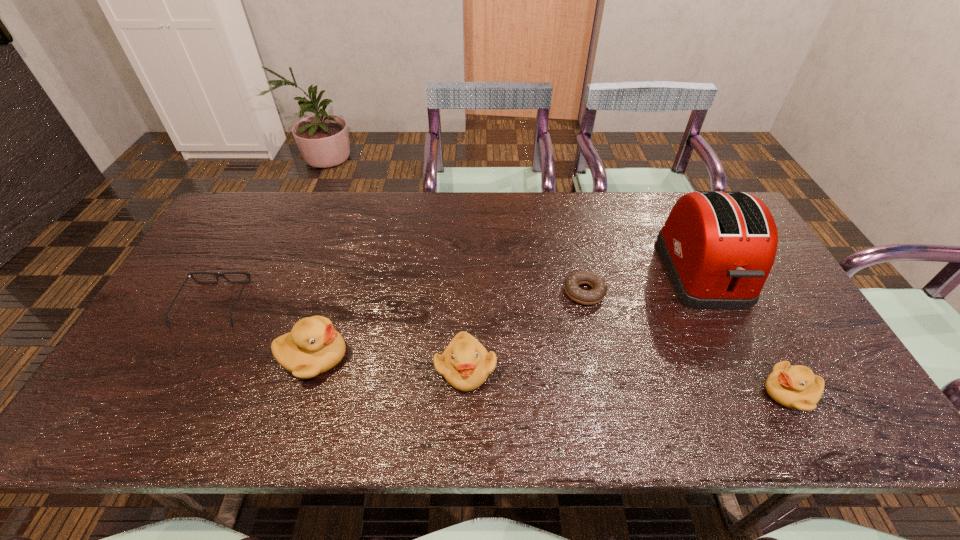
To ensure equal spacing by inserting another duckling among them, please point out a vacant spot for this new duckling. Please provide its 2D coordinates. Your answer should be formatted as a tuple, i.e. [(x, y)], where the tuple contains the x and y coordinates of a point satisfying the conditions above.

[(624, 380)]